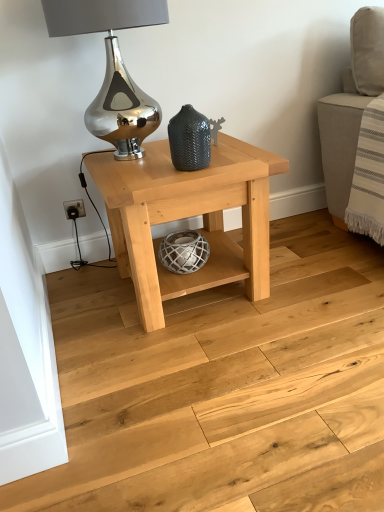
Question: Can you confirm if matte dark gray textured vase at center is wider than natural wood table at center?

Choices:
 (A) yes
 (B) no

Answer: (B)

Question: Does matte dark gray textured vase at center appear on the left side of natural wood table at center?

Choices:
 (A) no
 (B) yes

Answer: (A)

Question: Can you confirm if matte dark gray textured vase at center is smaller than natural wood table at center?

Choices:
 (A) no
 (B) yes

Answer: (B)

Question: From a real-world perspective, does matte dark gray textured vase at center stand above natural wood table at center?

Choices:
 (A) yes
 (B) no

Answer: (A)

Question: Are matte dark gray textured vase at center and natural wood table at center located far from each other?

Choices:
 (A) no
 (B) yes

Answer: (A)

Question: Can you confirm if matte dark gray textured vase at center is bigger than natural wood table at center?

Choices:
 (A) no
 (B) yes

Answer: (A)

Question: Is matte dark gray textured vase at center outside natural wood floor at center?

Choices:
 (A) yes
 (B) no

Answer: (A)

Question: Can you confirm if matte dark gray textured vase at center is bigger than natural wood floor at center?

Choices:
 (A) yes
 (B) no

Answer: (B)

Question: Is natural wood floor at center at the back of matte dark gray textured vase at center?

Choices:
 (A) no
 (B) yes

Answer: (A)

Question: Does matte dark gray textured vase at center have a greater width compared to natural wood floor at center?

Choices:
 (A) yes
 (B) no

Answer: (B)

Question: From a real-world perspective, is matte dark gray textured vase at center below natural wood floor at center?

Choices:
 (A) no
 (B) yes

Answer: (A)

Question: From the image's perspective, is matte dark gray textured vase at center on top of natural wood floor at center?

Choices:
 (A) yes
 (B) no

Answer: (A)

Question: Is natural wood table at center shorter than natural wood floor at center?

Choices:
 (A) no
 (B) yes

Answer: (A)